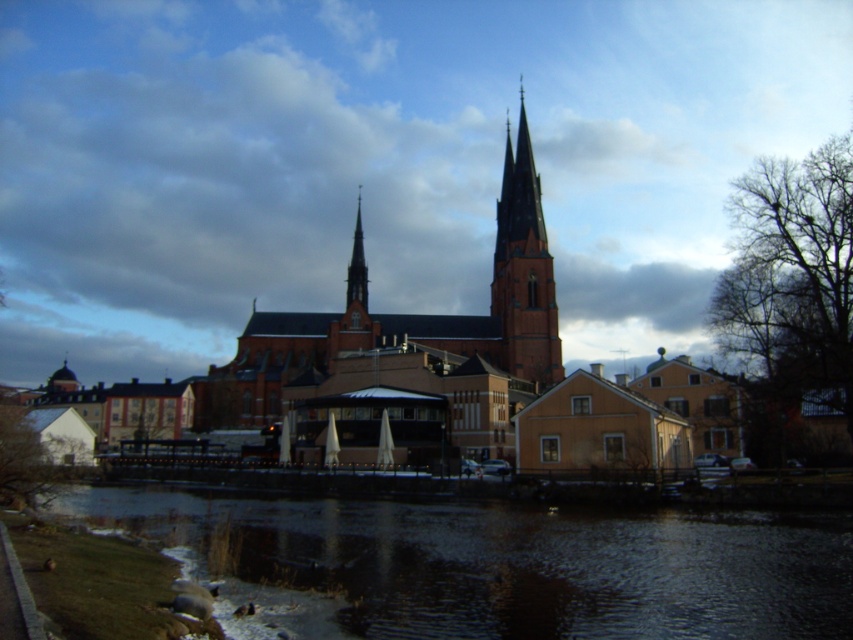
You are a drone operator tasked with capturing aerial footage of the church. Your drone has a maximum flight altitude of 50 meters. The brick steeple at center and the smooth red brick spire at center are both within your camera view. Can you determine which one is taller based on the given information?

The brick steeple at center is taller than the smooth red brick spire at center, so the drone operator can confirm that the brick steeple at center is the taller structure between the two.

You are standing at the center of the town square, which is located at point coordinates of 0.5, 0.5. You want to take a photo of the red brick church at center. In which direction should you move to ensure the church is in the frame?

The red brick church at center is located at point coordinates of (416, 342), which is slightly northeast of the town square center at (426, 320). Therefore, you should move slightly northeast to center the church in your photo.

You are standing in the town square facing the red brick church at center and the smooth red brick spire at center. Which one is positioned to the right side from your viewpoint?

The red brick church at center is to the right of the smooth red brick spire at center, so the red brick church at center is positioned to the right side from your viewpoint.